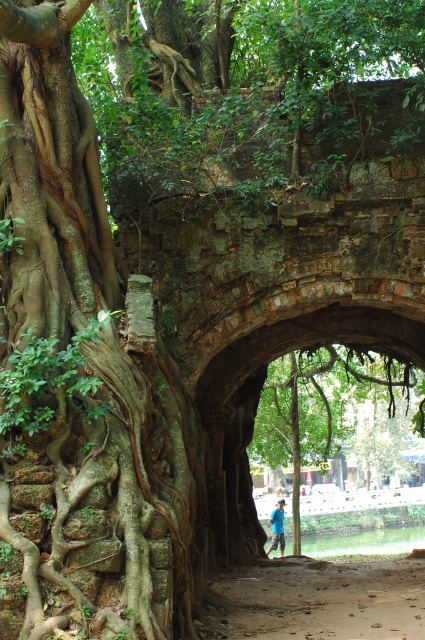
Measure the distance from brown rough bark banyan tree at left to green rough bark tree at center.

brown rough bark banyan tree at left and green rough bark tree at center are 22.38 meters apart.

Is brown rough bark banyan tree at left behind green rough bark tree at center?

No, it is in front of green rough bark tree at center.

Who is more forward, (19, 420) or (303, 467)?

Positioned in front is point (19, 420).

This screenshot has height=640, width=425. Find the location of `brown rough bark banyan tree at left`. brown rough bark banyan tree at left is located at coordinates (82, 376).

Does point (116, 584) lie behind point (277, 513)?

No, it is in front of (277, 513).

Who is more forward, [163,380] or [269,547]?

Positioned in front is point [163,380].

Identify the location of brown rough bark banyan tree at left. The image size is (425, 640). (82, 376).

You are a GUI agent. You are given a task and a screenshot of the screen. Output one action in this format:
    pyautogui.click(x=<x>, y=<y>)
    Task: Click on the brown rough bark banyan tree at left
    
    Given the screenshot: What is the action you would take?
    (82, 376)

Does brown rough bark banyan tree at left appear under brown dirt path at center?

Incorrect, brown rough bark banyan tree at left is not positioned below brown dirt path at center.

Is brown rough bark banyan tree at left smaller than brown dirt path at center?

Correct, brown rough bark banyan tree at left occupies less space than brown dirt path at center.

Is point (25, 72) behind point (422, 625)?

No, it is not.

Locate an element on the screen. Image resolution: width=425 pixels, height=640 pixels. brown rough bark banyan tree at left is located at coordinates [x=82, y=376].